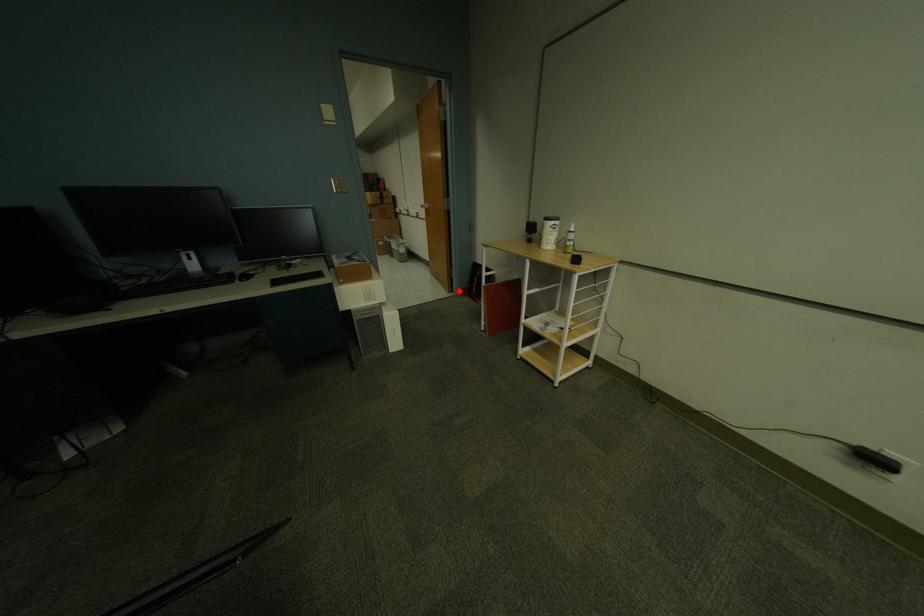
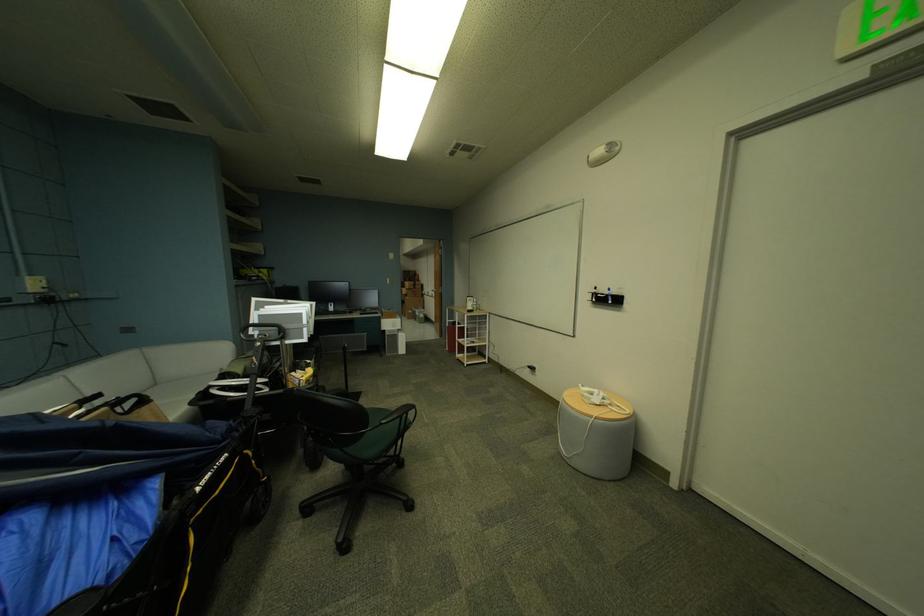
Question: I am providing you with two images of the same scene from different viewpoints. A red point is marked on the first image. Is the red point's position out of view in image 2?

Choices:
 (A) Yes
 (B) No

Answer: (B)